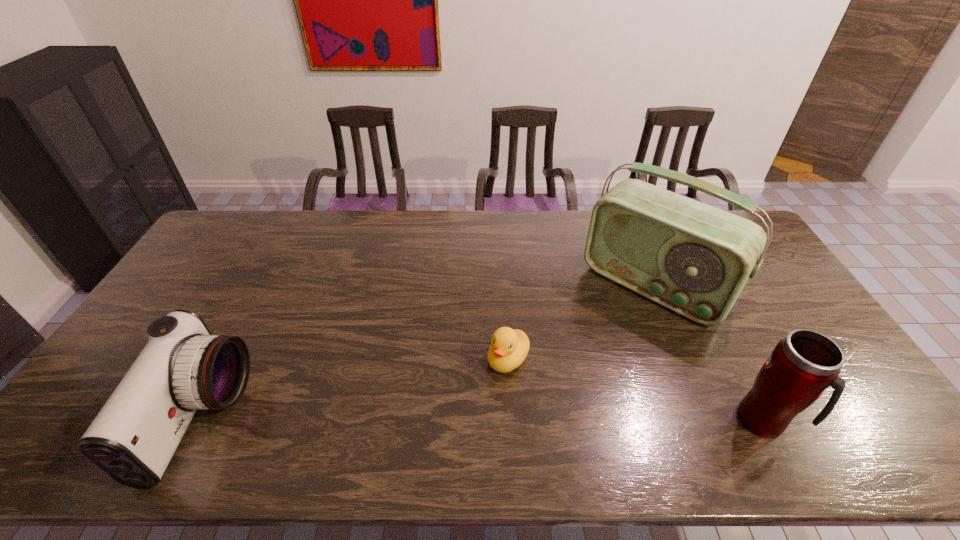
Identify the location of vacant space located 0.350m on the front panel of the radio receiver. (555, 401).

This screenshot has height=540, width=960. What are the coordinates of `vacant point located 0.130m on the face of the duckling` in the screenshot? It's located at [x=463, y=408].

Find the location of `free space located 0.160m on the face of the duckling`. free space located 0.160m on the face of the duckling is located at coordinates (455, 416).

Identify the location of blank space located 0.120m on the face of the duckling. (466, 406).

Find the location of a particular element. object at the far edge is located at coordinates (692, 258).

Find the location of a particular element. The height and width of the screenshot is (540, 960). camcorder present at the near edge is located at coordinates (183, 368).

Where is `thermos bottle located in the near edge section of the desktop`? The height and width of the screenshot is (540, 960). thermos bottle located in the near edge section of the desktop is located at coordinates (802, 365).

The width and height of the screenshot is (960, 540). In the image, there is a desktop. Find the location of `free space at the far edge`. free space at the far edge is located at coordinates (416, 226).

In the image, there is a desktop. Where is `blank space at the near edge`? blank space at the near edge is located at coordinates point(519,417).

Where is `vacant space at the left edge of the desktop`? Image resolution: width=960 pixels, height=540 pixels. vacant space at the left edge of the desktop is located at coordinates (236, 265).